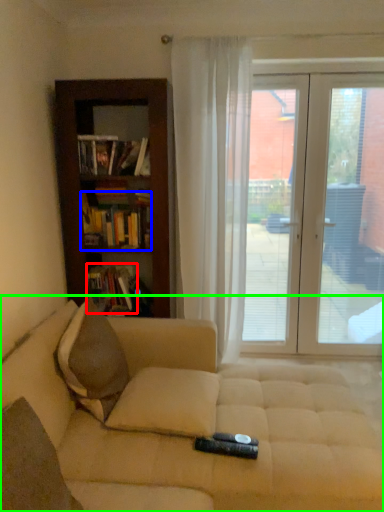
Question: Considering the real-world distances, which object is farthest from book (highlighted by a red box)? book (highlighted by a blue box) or studio couch (highlighted by a green box)?

Choices:
 (A) book
 (B) studio couch

Answer: (B)